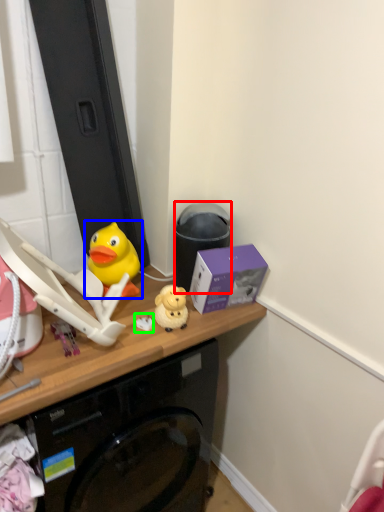
Question: Which object is the farthest from trash bin/can (highlighted by a red box)? Choose among these: toy (highlighted by a blue box) or toy (highlighted by a green box).

Choices:
 (A) toy
 (B) toy

Answer: (B)